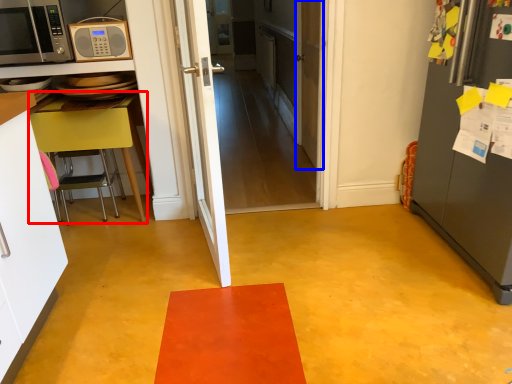
Question: Among these objects, which one is nearest to the camera, table (highlighted by a red box) or door (highlighted by a blue box)?

Choices:
 (A) table
 (B) door

Answer: (A)